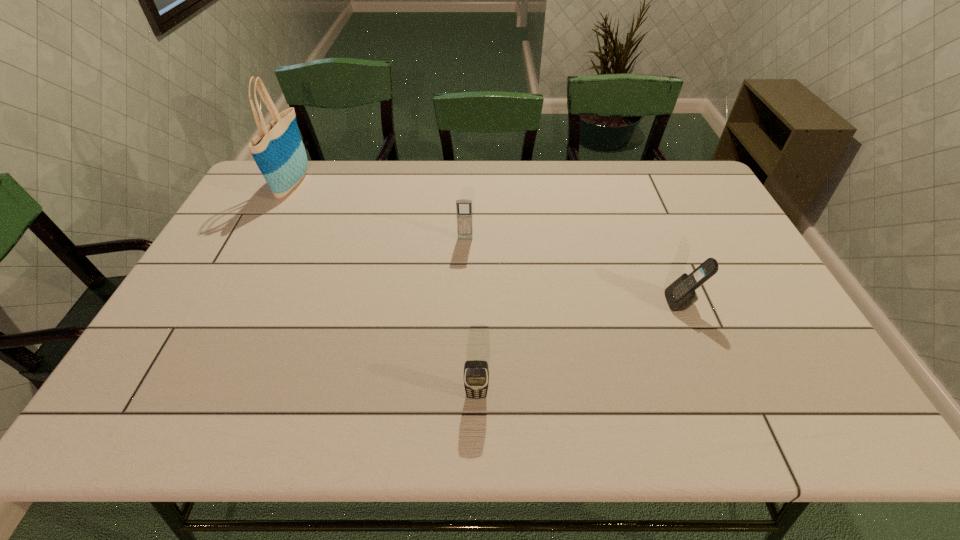
The image size is (960, 540). In order to click on vacant space at the far right corner of the desktop in this screenshot , I will do `click(660, 181)`.

In order to click on free area in between the nearest cellular telephone and the second farthest object in this screenshot , I will do `click(470, 317)`.

Identify the location of free spot between the rightmost object and the tallest object. This screenshot has width=960, height=540. (488, 243).

Where is `vacant region between the tote bag and the farthest cellular telephone`? This screenshot has width=960, height=540. vacant region between the tote bag and the farthest cellular telephone is located at coordinates (379, 212).

Locate an element on the screen. The height and width of the screenshot is (540, 960). free space between the third farthest object and the farthest cellular telephone is located at coordinates (574, 271).

Where is `free space between the farthest cellular telephone and the third farthest object`? Image resolution: width=960 pixels, height=540 pixels. free space between the farthest cellular telephone and the third farthest object is located at coordinates [574, 271].

Locate an element on the screen. The width and height of the screenshot is (960, 540). empty location between the farthest cellular telephone and the second farthest cellular telephone is located at coordinates (574, 271).

This screenshot has width=960, height=540. I want to click on blank region between the rightmost cellular telephone and the third nearest object, so click(574, 271).

I want to click on vacant space in between the shortest cellular telephone and the leftmost object, so click(385, 289).

Find the location of a particular element. The height and width of the screenshot is (540, 960). empty space between the farthest cellular telephone and the nearest cellular telephone is located at coordinates (470, 317).